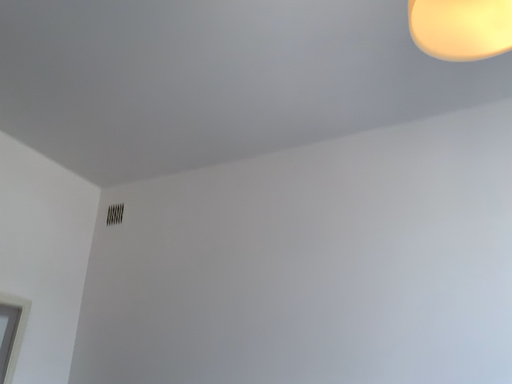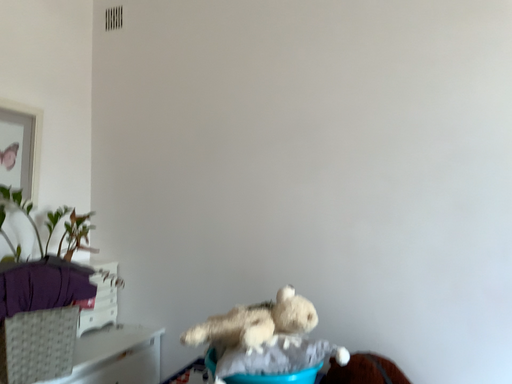
Question: How did the camera likely rotate when shooting the video?

Choices:
 (A) rotated upward
 (B) rotated downward

Answer: (B)